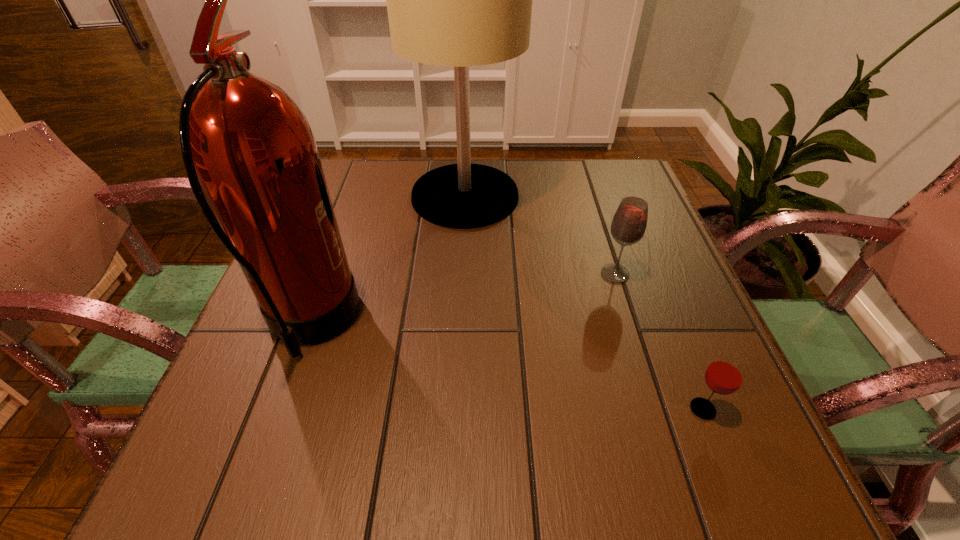
The image size is (960, 540). Identify the location of vacant space at the near right corner. (705, 474).

Image resolution: width=960 pixels, height=540 pixels. I want to click on unoccupied area between the farthest object and the nearest object, so click(584, 302).

At what (x,y) coordinates should I click in order to perform the action: click on free space between the rightmost object and the second object from right to left. Please return your answer as a coordinate pair (x, y). This screenshot has width=960, height=540. Looking at the image, I should click on (659, 341).

This screenshot has height=540, width=960. I want to click on free space between the left glass and the fire extinguisher, so click(x=463, y=299).

This screenshot has height=540, width=960. In order to click on vacant area between the nearest object and the third tallest object in this screenshot , I will do `click(659, 341)`.

At what (x,y) coordinates should I click in order to perform the action: click on free space between the third object from right to left and the shorter glass. Please return your answer as a coordinate pair (x, y). The image size is (960, 540). Looking at the image, I should click on (584, 302).

You are a GUI agent. You are given a task and a screenshot of the screen. Output one action in this format:
    pyautogui.click(x=<x>, y=<y>)
    Task: Click on the blank region between the leftmost object and the shortest object
    This screenshot has width=960, height=540.
    Given the screenshot: What is the action you would take?
    pyautogui.click(x=506, y=367)

The height and width of the screenshot is (540, 960). I want to click on vacant area that lies between the fire extinguisher and the second object from left to right, so click(x=388, y=260).

Identify the location of free space between the fire extinguisher and the farther glass. The height and width of the screenshot is (540, 960). pyautogui.click(x=463, y=299).

At what (x,y) coordinates should I click in order to perform the action: click on vacant area between the fire extinguisher and the farthest object. Please return your answer as a coordinate pair (x, y). Looking at the image, I should click on (388, 260).